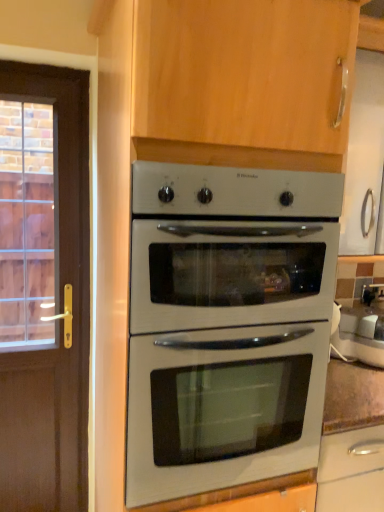
Question: Is white glossy kettle at right in front of or behind white glossy oven at center in the image?

Choices:
 (A) front
 (B) behind

Answer: (B)

Question: Does point (340, 345) appear closer or farther from the camera than point (132, 486)?

Choices:
 (A) closer
 (B) farther

Answer: (B)

Question: Considering the positions of white glossy kettle at right and white glossy oven at center in the image, is white glossy kettle at right bigger or smaller than white glossy oven at center?

Choices:
 (A) small
 (B) big

Answer: (A)

Question: Is white glossy oven at center in front of or behind white glossy kettle at right in the image?

Choices:
 (A) front
 (B) behind

Answer: (A)

Question: From a real-world perspective, relative to white glossy kettle at right, is white glossy oven at center vertically above or below?

Choices:
 (A) below
 (B) above

Answer: (B)

Question: From the image's perspective, relative to white glossy kettle at right, is white glossy oven at center above or below?

Choices:
 (A) below
 (B) above

Answer: (B)

Question: Would you say white glossy oven at center is inside or outside white glossy kettle at right?

Choices:
 (A) inside
 (B) outside

Answer: (B)